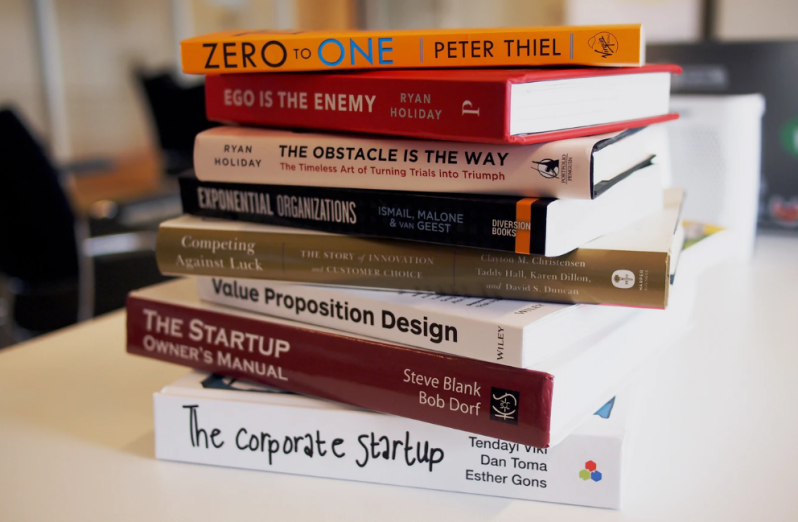
Where is `book`? The height and width of the screenshot is (522, 798). book is located at coordinates (321, 371), (374, 315), (377, 268), (358, 208), (377, 171), (356, 102), (366, 44), (353, 450).